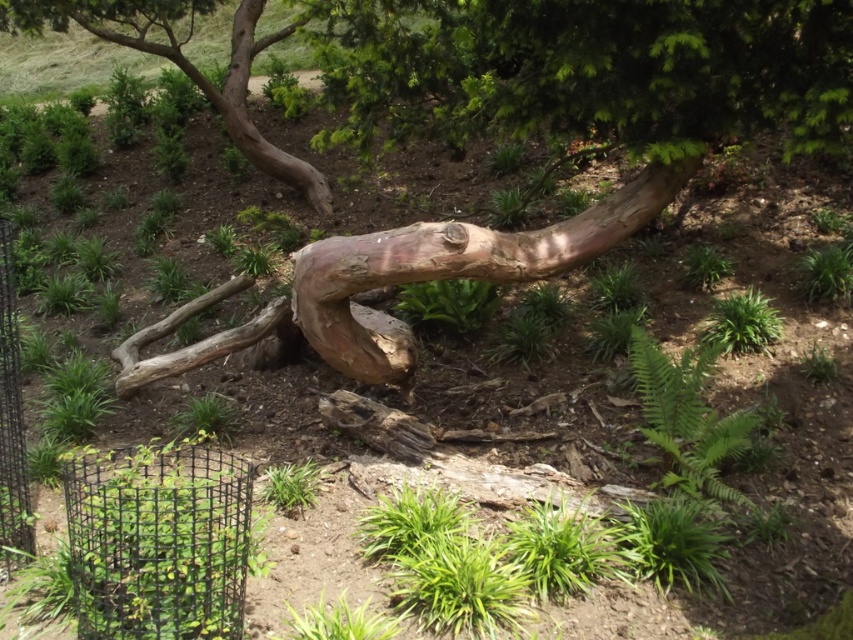
Question: Which object is positioned farthest from the black wire fence at lower left?

Choices:
 (A) natural wood tree trunk at center
 (B) brown rough bark tree at upper left

Answer: (B)

Question: Which point appears closest to the camera in this image?

Choices:
 (A) (1, 360)
 (B) (358, 273)
 (C) (115, 17)

Answer: (A)

Question: Which of the following is the closest to the observer?

Choices:
 (A) black wire fence at lower left
 (B) brown rough bark tree at upper left

Answer: (A)

Question: Can you confirm if brown rough bark tree at upper left is thinner than black wire fence at lower left?

Choices:
 (A) no
 (B) yes

Answer: (A)

Question: Is natural wood tree trunk at center below brown rough bark tree at upper left?

Choices:
 (A) no
 (B) yes

Answer: (B)

Question: Where is brown rough bark tree at upper left located in relation to black wire fence at lower left in the image?

Choices:
 (A) above
 (B) below

Answer: (A)